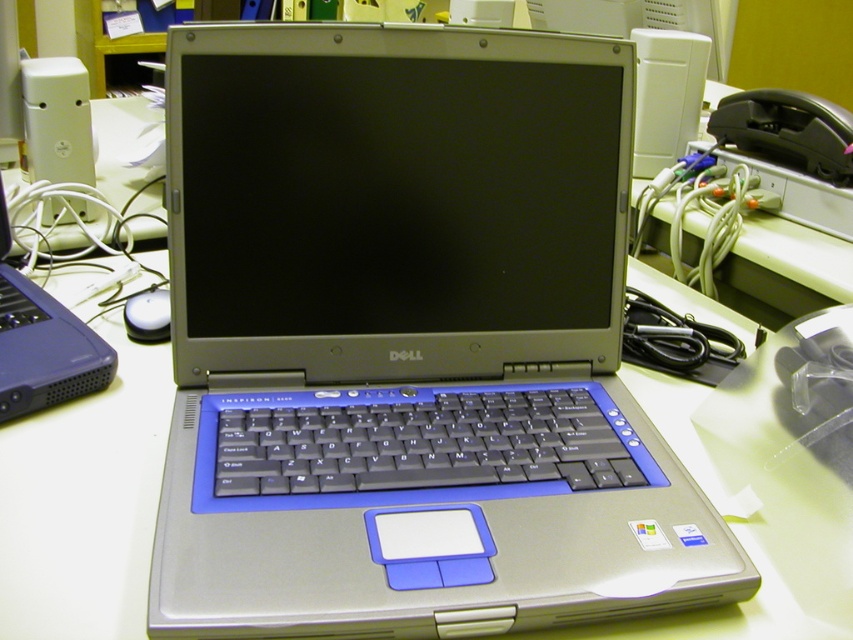
Which is more to the right, silver metallic laptop at center or matte black laptop at left?

silver metallic laptop at center

Who is higher up, silver metallic laptop at center or matte black laptop at left?

Positioned higher is matte black laptop at left.

What do you see at coordinates (409, 342) in the screenshot?
I see `silver metallic laptop at center` at bounding box center [409, 342].

At what (x,y) coordinates should I click in order to perform the action: click on silver metallic laptop at center. Please return your answer as a coordinate pair (x, y). The image size is (853, 640). Looking at the image, I should click on (409, 342).

Is silver metallic computer monitor at center taller than matte black laptop at left?

Indeed, silver metallic computer monitor at center has a greater height compared to matte black laptop at left.

Is silver metallic computer monitor at center thinner than matte black laptop at left?

No, silver metallic computer monitor at center is not thinner than matte black laptop at left.

Who is more distant from viewer, (555, 56) or (4, 346)?

The point (4, 346) is more distant.

The width and height of the screenshot is (853, 640). In order to click on silver metallic computer monitor at center in this screenshot , I will do `click(393, 200)`.

From the picture: Can you confirm if matte black laptop at left is positioned to the right of white glossy mouse at center?

In fact, matte black laptop at left is to the left of white glossy mouse at center.

The height and width of the screenshot is (640, 853). Find the location of `matte black laptop at left`. matte black laptop at left is located at coordinates (42, 342).